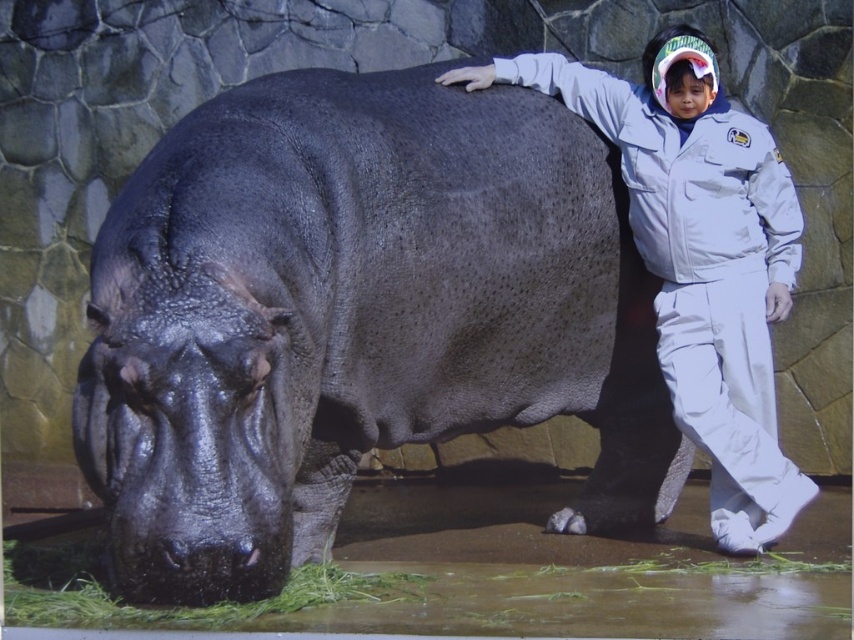
You are a visitor at the zoo and see the shiny dark gray hippo at center and the white matte jacket at center. Which object is shorter?

The shiny dark gray hippo at center is not as tall as the white matte jacket at center, so the hippo is shorter.

You are a zookeeper carrying a 1.8 meter long ladder. You need to place the ladder between the white matte jacket at center and the green leafy grass at lower left. Will the ladder fit in that space?

The distance between the white matte jacket at center and the green leafy grass at lower left is 2.06 meters. Since the ladder is 1.8 meters long, it will fit comfortably within the space.

You are a visitor at a zoo and see the shiny dark gray hippo at center and the white matte jacket at center. Which object is located to the right of the other?

The white matte jacket at center is located to the right of the shiny dark gray hippo at center because the hippo is on the left side of the jacket.